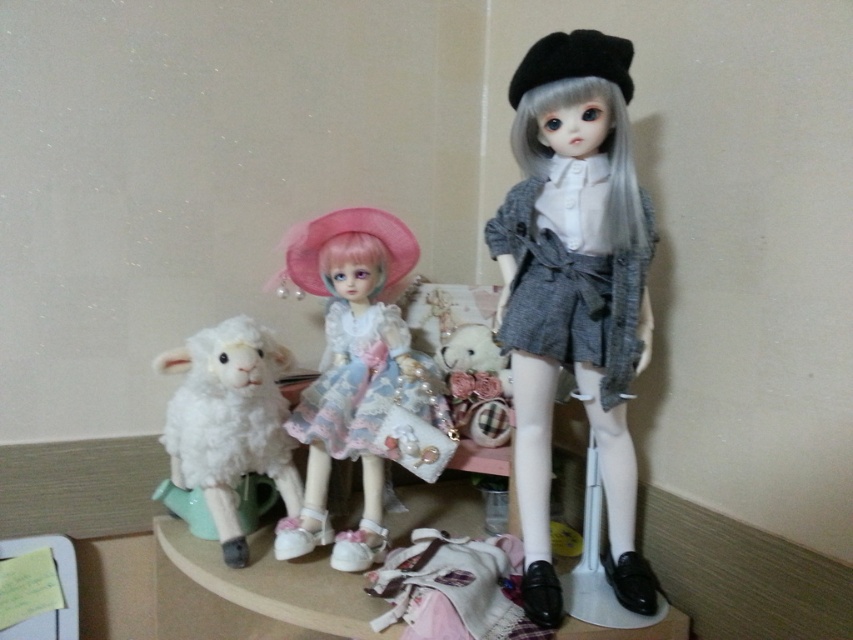
Does white fluffy sheep at left have a lesser width compared to fluffy white sheep at center?

No, white fluffy sheep at left is not thinner than fluffy white sheep at center.

The width and height of the screenshot is (853, 640). Identify the location of white fluffy sheep at left. (229, 422).

Image resolution: width=853 pixels, height=640 pixels. In order to click on white fluffy sheep at left in this screenshot , I will do `click(229, 422)`.

The width and height of the screenshot is (853, 640). I want to click on white fluffy sheep at left, so click(229, 422).

Which is more to the left, matte pink fabric doll at center or fluffy white sheep at center?

From the viewer's perspective, matte pink fabric doll at center appears more on the left side.

Is point (343, 416) farther from camera compared to point (496, 346)?

No, (343, 416) is closer to viewer.

Locate an element on the screen. The height and width of the screenshot is (640, 853). matte pink fabric doll at center is located at coordinates (352, 372).

Looking at this image, between matte pink fabric doll at center and white fluffy sheep at left, which one is positioned lower?

white fluffy sheep at left is lower down.

Does matte pink fabric doll at center appear on the right side of white fluffy sheep at left?

Yes, matte pink fabric doll at center is to the right of white fluffy sheep at left.

Does point (402, 394) lie in front of point (202, 396)?

No, it is not.

The height and width of the screenshot is (640, 853). I want to click on matte pink fabric doll at center, so click(x=352, y=372).